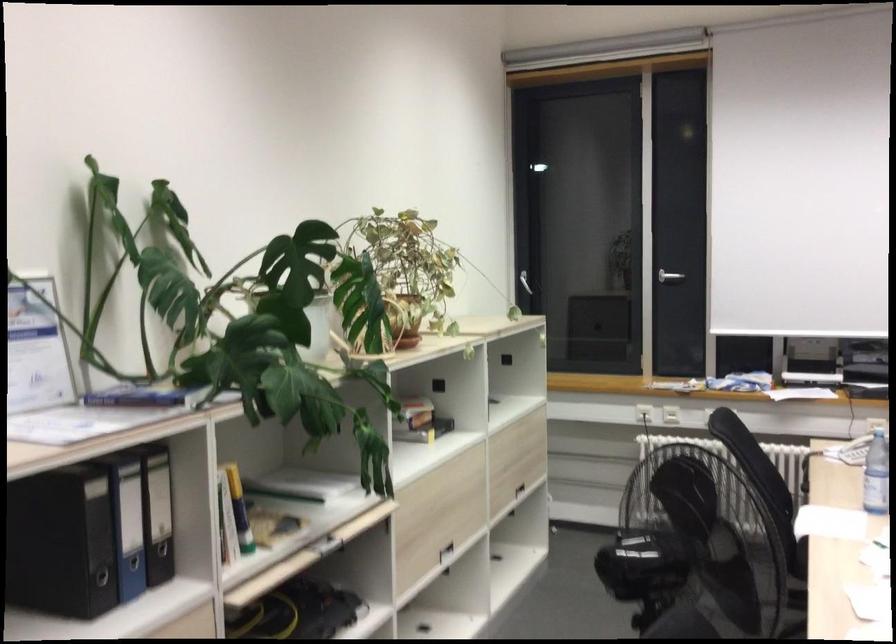
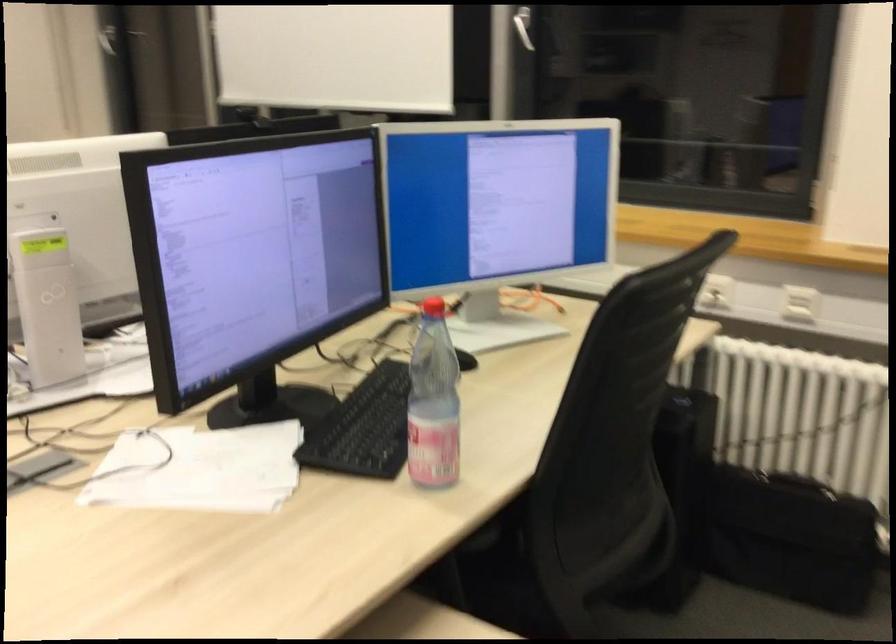
Question: The images are taken continuously from a first-person perspective. In which direction are you moving?

Choices:
 (A) Left
 (B) Right
 (C) Forward
 (D) Backward

Answer: (B)